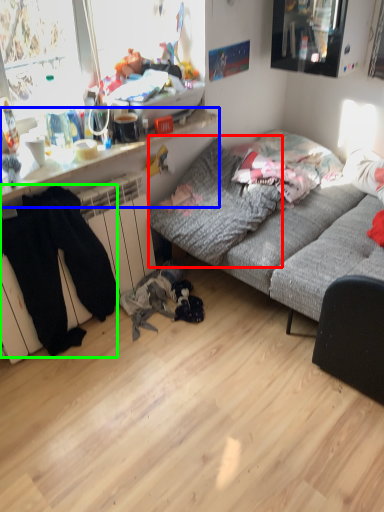
Question: Estimate the real-world distances between objects in this image. Which object is closer to pillow (highlighted by a red box), desk (highlighted by a blue box) or clothing (highlighted by a green box)?

Choices:
 (A) desk
 (B) clothing

Answer: (A)